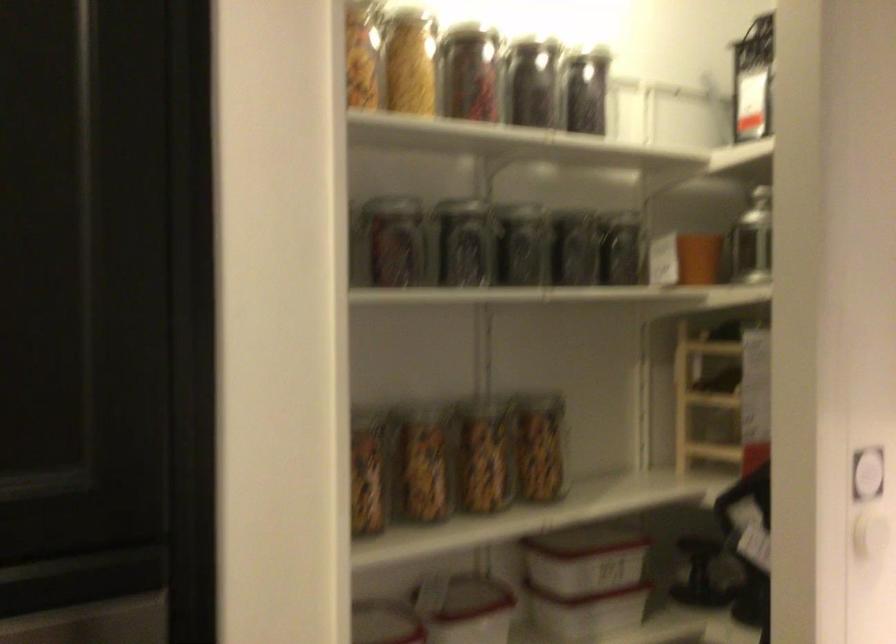
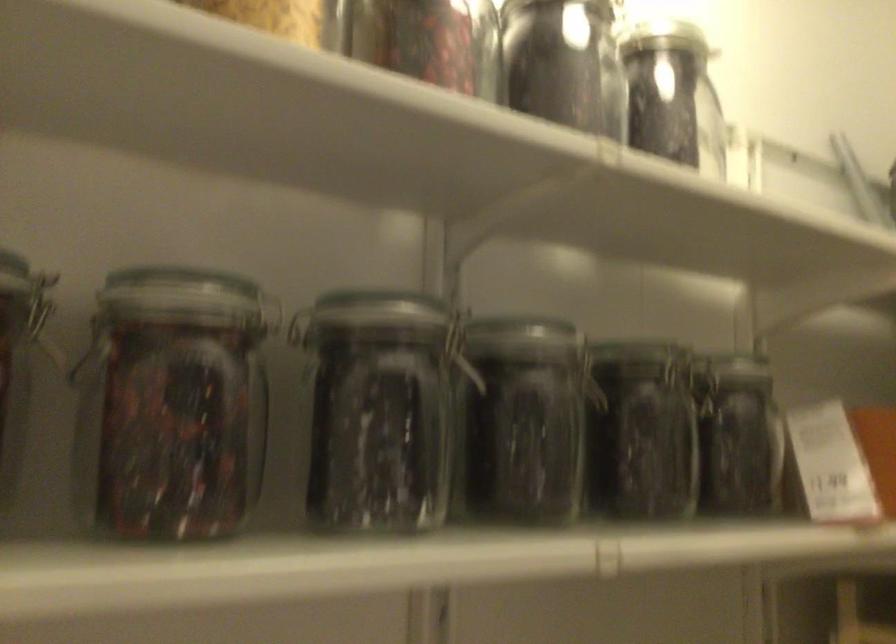
Question: In a continuous first-person perspective shot, in which direction is the camera moving?

Choices:
 (A) Left
 (B) Right
 (C) Forward
 (D) Backward

Answer: (C)